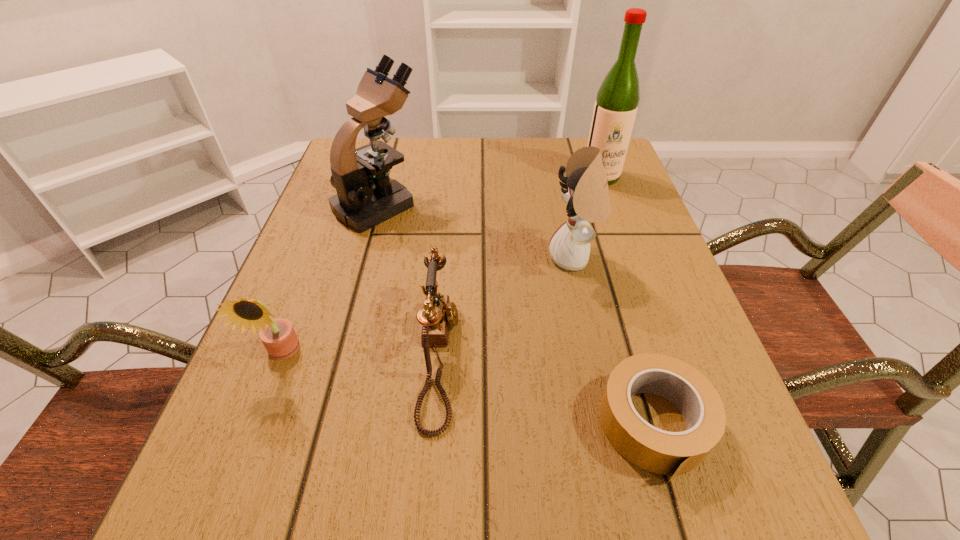
The height and width of the screenshot is (540, 960). Find the location of `liquor that is at the right edge`. liquor that is at the right edge is located at coordinates (616, 105).

Find the location of a particular element. The height and width of the screenshot is (540, 960). doll present at the right edge is located at coordinates (586, 193).

This screenshot has height=540, width=960. Identify the location of duct tape located in the right edge section of the desktop. (662, 452).

The height and width of the screenshot is (540, 960). I want to click on object that is at the far left corner, so click(366, 196).

I want to click on object present at the far right corner, so click(616, 105).

Where is `object that is at the near right corner`? The image size is (960, 540). object that is at the near right corner is located at coordinates pyautogui.click(x=662, y=452).

In the image, there is a desktop. Identify the location of free region at the far edge. (416, 149).

Locate an element on the screen. This screenshot has height=540, width=960. vacant space at the left edge is located at coordinates click(x=294, y=272).

In the image, there is a desktop. Identify the location of vacant space at the right edge. (684, 316).

Image resolution: width=960 pixels, height=540 pixels. What are the coordinates of `vacant area that lies between the third tallest object and the second shortest object` in the screenshot? It's located at (507, 307).